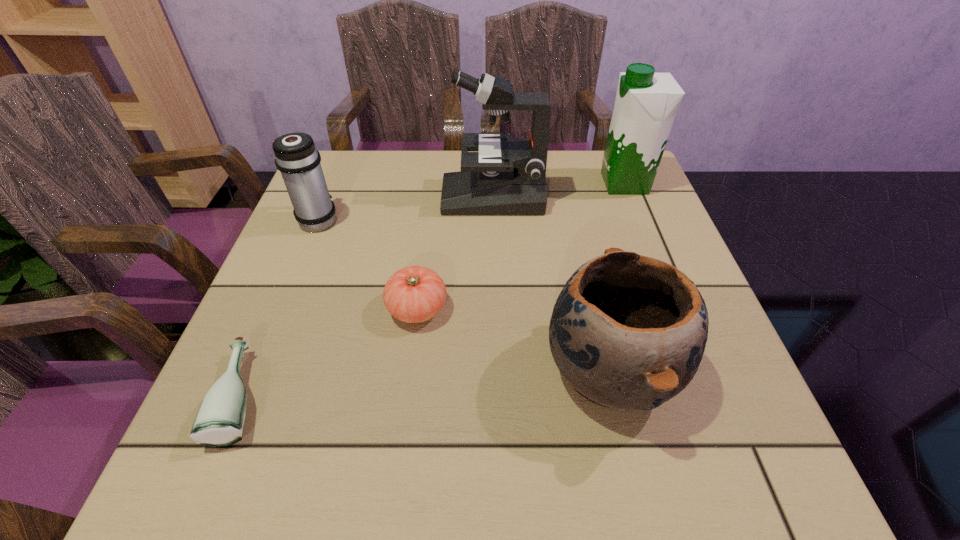
Where is `free space at the near edge`? free space at the near edge is located at coordinates (437, 474).

In order to click on free space at the left edge in this screenshot , I will do `click(316, 274)`.

In the image, there is a desktop. What are the coordinates of `vacant space at the right edge` in the screenshot? It's located at (676, 425).

In the image, there is a desktop. Where is `vacant space at the far left corner`? Image resolution: width=960 pixels, height=540 pixels. vacant space at the far left corner is located at coordinates (334, 186).

You are a GUI agent. You are given a task and a screenshot of the screen. Output one action in this format:
    pyautogui.click(x=<x>, y=<y>)
    Task: Click on the free space between the bottle and the microscope
    Image resolution: width=960 pixels, height=540 pixels.
    Given the screenshot: What is the action you would take?
    pyautogui.click(x=369, y=296)

Locate an element on the screen. This screenshot has height=540, width=960. vacant space that is in between the pottery and the shortest object is located at coordinates (427, 383).

Image resolution: width=960 pixels, height=540 pixels. Identify the location of blank region between the bottle and the fifth tallest object. (331, 353).

The width and height of the screenshot is (960, 540). In order to click on unoccupied position between the fifth tallest object and the pottery in this screenshot , I will do `click(514, 340)`.

Find the location of `vacant space that is in between the second shortest object and the pottery`. vacant space that is in between the second shortest object and the pottery is located at coordinates (514, 340).

Identify the location of free space between the pottery and the shortest object. (427, 383).